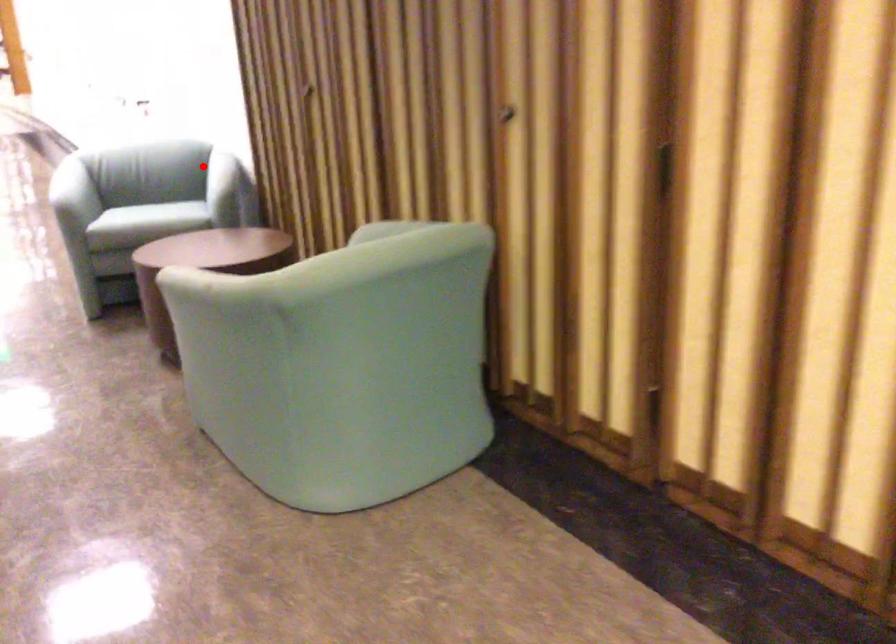
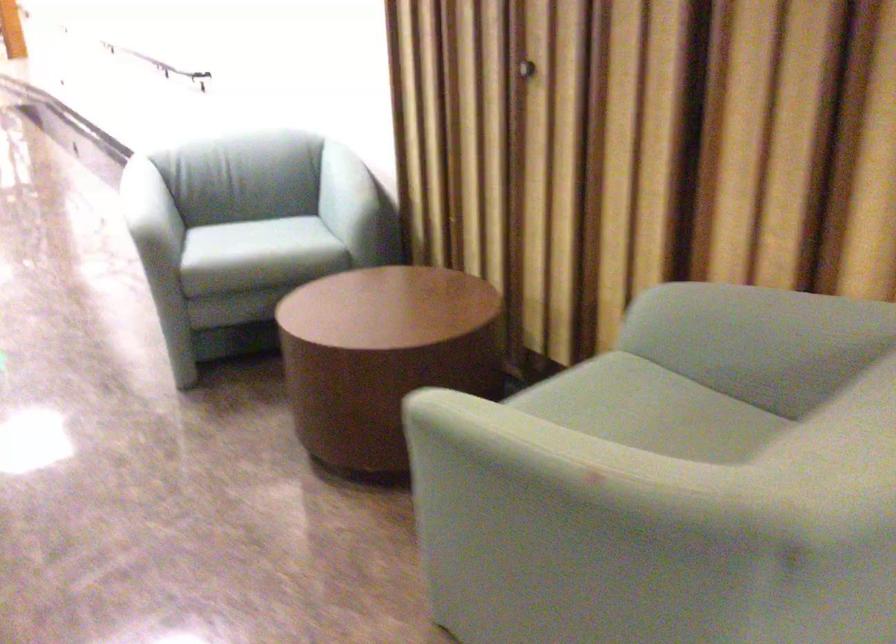
Question: I am providing you with two images of the same scene from different viewpoints. A red point is shown in image1. For the corresponding object point in image2, is it positioned nearer or farther from the camera?

Choices:
 (A) Nearer
 (B) Farther

Answer: (A)